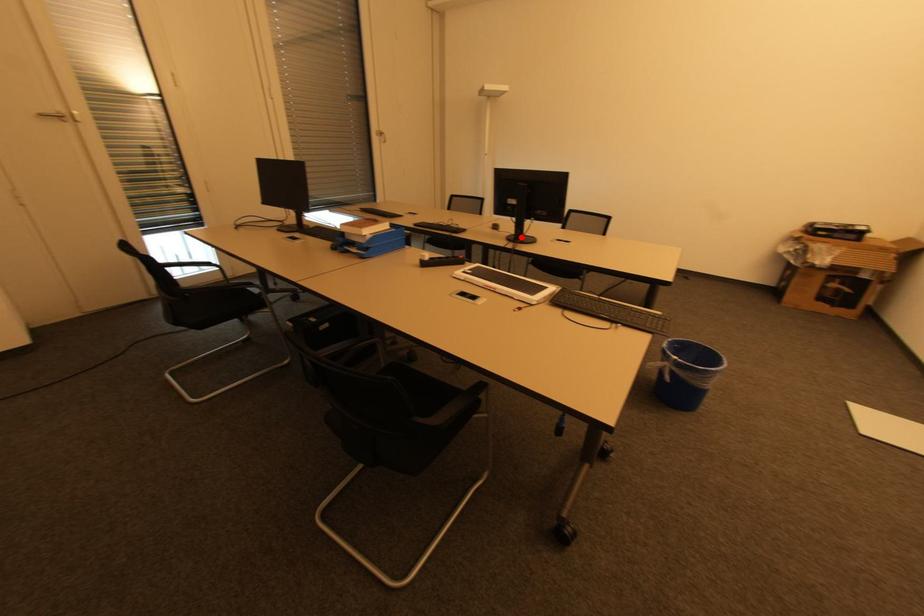
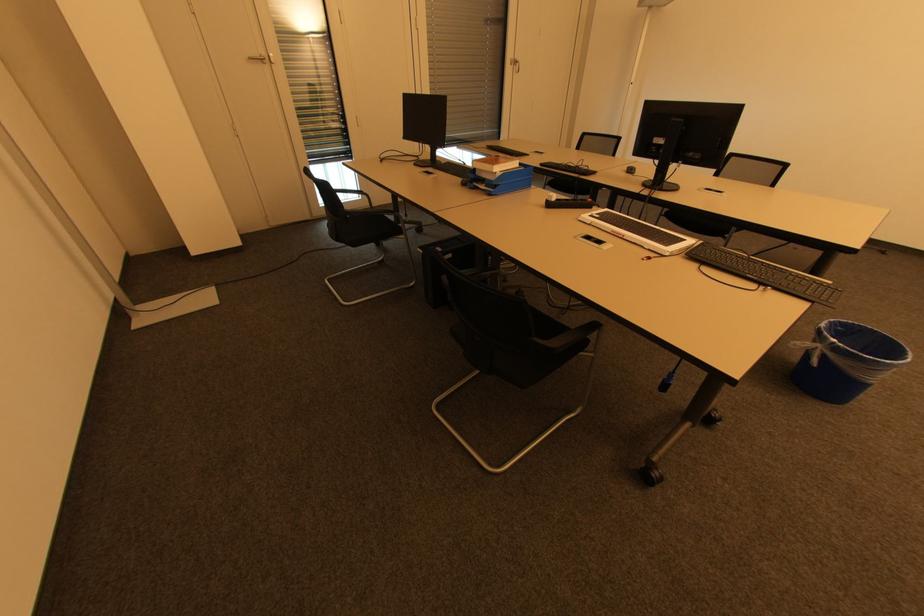
In the second image, find the point that corresponds to the highlighted location in the first image.

(660, 183)